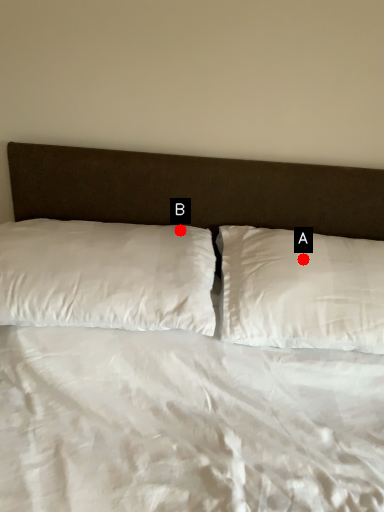
Question: Two points are circled on the image, labeled by A and B beside each circle. Which point is closer to the camera?

Choices:
 (A) A is closer
 (B) B is closer

Answer: (A)